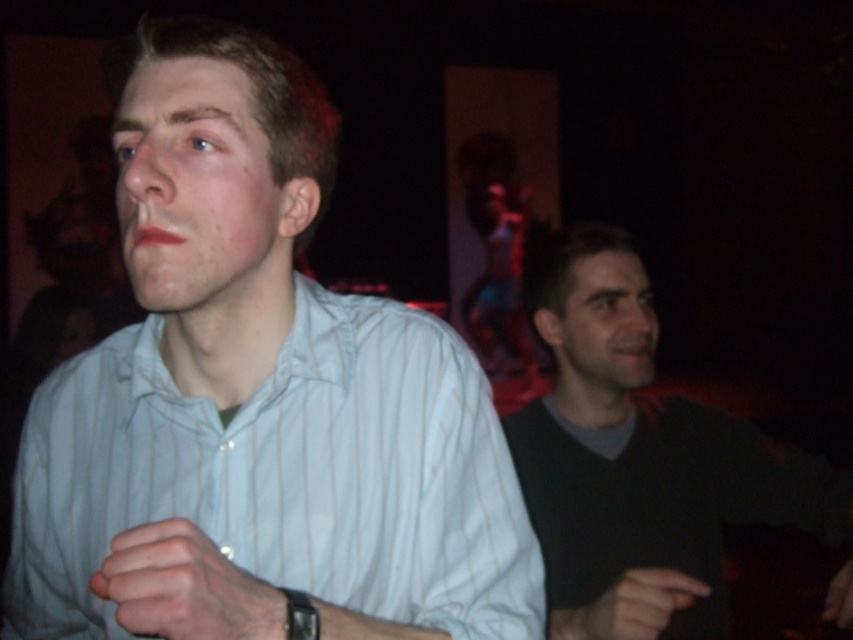
You are taking a photo of two points in the image. The first point is at coordinates point (138, 536) and the second point is at point (299, 637). Which point will appear larger in your photo?

Point (138, 536) is closer to the camera than point (299, 637), so it will appear larger in the photo.

You are a fashion designer analyzing the image. You need to determine the spatial relationship between the white striped shirt at center and the black rubber wristband at lower center. Which object is positioned higher in the image?

The white striped shirt at center is positioned higher than the black rubber wristband at lower center.

You are a fashion designer analyzing this image. You need to determine the spatial relationship between the dark gray sweater at right and the black rubber wristband at lower center. Which object is positioned higher in the image?

The dark gray sweater at right is located above the black rubber wristband at lower center, so the dark gray sweater at right is positioned higher in the image.